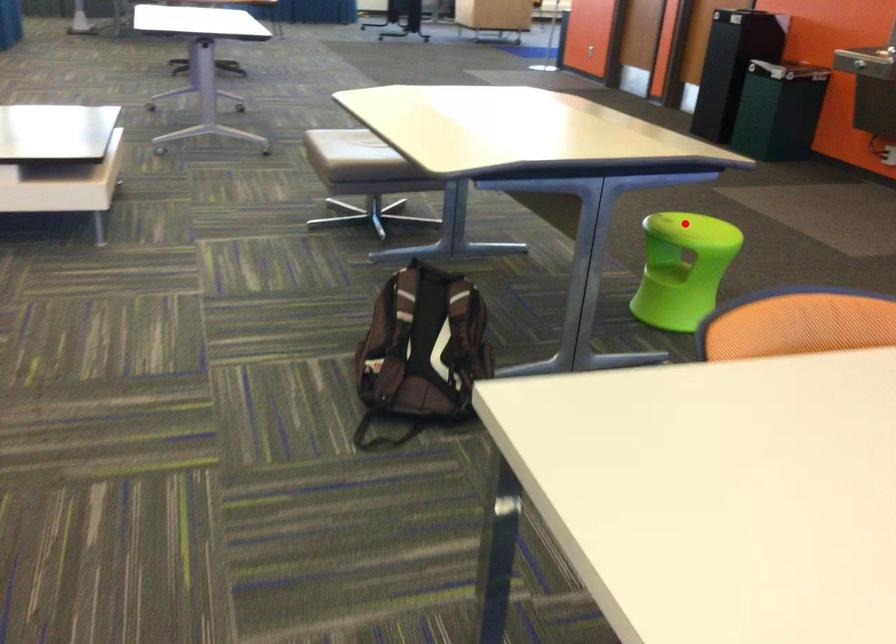
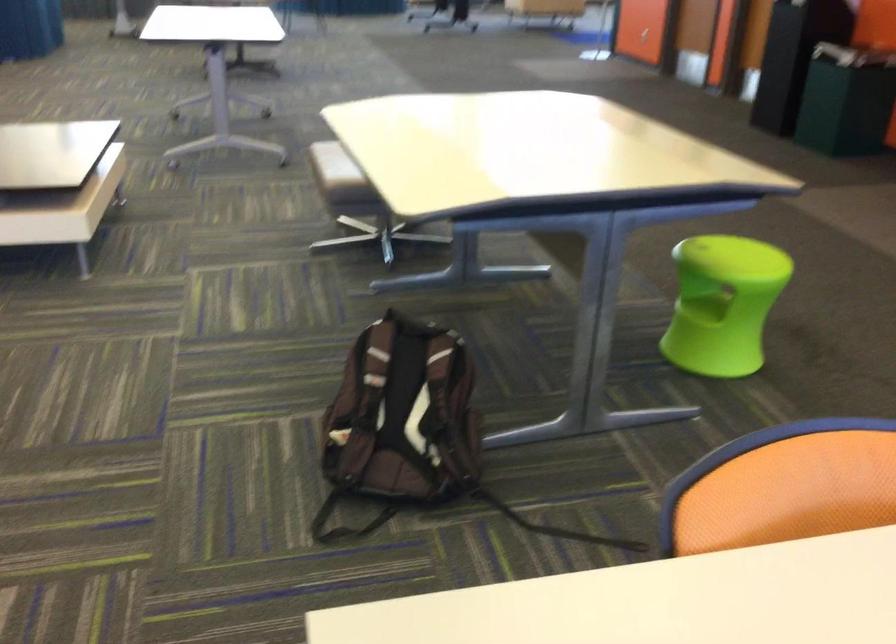
The point at the highlighted location is marked in the first image. Where is the corresponding point in the second image?

(730, 247)